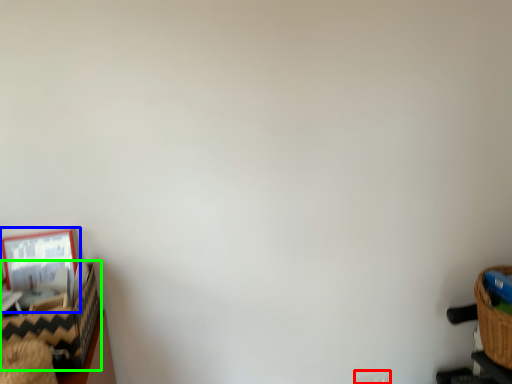
Question: Which object is positioned closest to electric outlet (highlighted by a red box)? Select from picture frame (highlighted by a blue box) and basket (highlighted by a green box).

Choices:
 (A) picture frame
 (B) basket

Answer: (B)